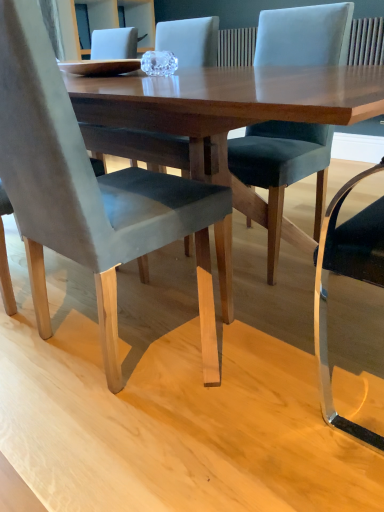
The image size is (384, 512). Describe the element at coordinates (89, 191) in the screenshot. I see `velvet grey chair at lower left, which is the 1th chair in left-to-right order` at that location.

Measure the distance between point (87,179) and camera.

A distance of 34.57 inches exists between point (87,179) and camera.

I want to click on velvet grey chair at lower left, which is the 1th chair in left-to-right order, so click(x=89, y=191).

Describe the element at coordinates (282, 169) in the screenshot. I see `velvet dark gray chair at center, the second chair viewed from the left` at that location.

Find the location of a particular element. The width and height of the screenshot is (384, 512). velvet dark gray chair at center, the 1th chair in the right-to-left sequence is located at coordinates (282, 169).

Measure the distance between point [284,153] and camera.

They are 1.50 meters apart.

You are a GUI agent. You are given a task and a screenshot of the screen. Output one action in this format:
    pyautogui.click(x=<x>, y=<y>)
    Task: Click on the velvet grey chair at lower left, which is the 1th chair in left-to-right order
    The height and width of the screenshot is (512, 384).
    Given the screenshot: What is the action you would take?
    pyautogui.click(x=89, y=191)

Which is more to the left, velvet grey chair at lower left, which is the second chair from right to left, or velvet dark gray chair at center, the 1th chair in the right-to-left sequence?

velvet grey chair at lower left, which is the second chair from right to left.

Consider the image. Relative to velvet dark gray chair at center, the 1th chair in the right-to-left sequence, is velvet grey chair at lower left, which is the 1th chair in left-to-right order, in front or behind?

In the image, velvet grey chair at lower left, which is the 1th chair in left-to-right order, appears in front of velvet dark gray chair at center, the 1th chair in the right-to-left sequence.

Which is closer, (x=118, y=376) or (x=274, y=155)?

Clearly, point (x=118, y=376) is closer to the camera than point (x=274, y=155).

From the image's perspective, which object appears higher, velvet grey chair at lower left, which is the second chair from right to left, or velvet dark gray chair at center, the 1th chair in the right-to-left sequence?

From the image's view, velvet dark gray chair at center, the 1th chair in the right-to-left sequence, is above.

From a real-world perspective, which object rests below the other?

velvet grey chair at lower left, which is the second chair from right to left.

Considering the sizes of velvet grey chair at lower left, which is the 1th chair in left-to-right order, and velvet dark gray chair at center, the 1th chair in the right-to-left sequence, in the image, is velvet grey chair at lower left, which is the 1th chair in left-to-right order, wider or thinner than velvet dark gray chair at center, the 1th chair in the right-to-left sequence,?

Considering their sizes, velvet grey chair at lower left, which is the 1th chair in left-to-right order, looks broader than velvet dark gray chair at center, the 1th chair in the right-to-left sequence.

Who is taller, velvet grey chair at lower left, which is the second chair from right to left, or velvet dark gray chair at center, the second chair viewed from the left?

velvet grey chair at lower left, which is the second chair from right to left, is taller.

From the picture: Does velvet grey chair at lower left, which is the 1th chair in left-to-right order, have a smaller size compared to velvet dark gray chair at center, the 1th chair in the right-to-left sequence?

Actually, velvet grey chair at lower left, which is the 1th chair in left-to-right order, might be larger than velvet dark gray chair at center, the 1th chair in the right-to-left sequence.

Is velvet grey chair at lower left, which is the 1th chair in left-to-right order, located outside velvet dark gray chair at center, the second chair viewed from the left?

velvet grey chair at lower left, which is the 1th chair in left-to-right order, lies outside velvet dark gray chair at center, the second chair viewed from the left,'s area.

Are velvet grey chair at lower left, which is the 1th chair in left-to-right order, and velvet dark gray chair at center, the second chair viewed from the left, far apart?

That's not correct — velvet grey chair at lower left, which is the 1th chair in left-to-right order, is a little close to velvet dark gray chair at center, the second chair viewed from the left.

Could you tell me if velvet grey chair at lower left, which is the 1th chair in left-to-right order, is facing velvet dark gray chair at center, the 1th chair in the right-to-left sequence?

Yes, velvet grey chair at lower left, which is the 1th chair in left-to-right order, is turned towards velvet dark gray chair at center, the 1th chair in the right-to-left sequence.

What's the angular difference between velvet grey chair at lower left, which is the second chair from right to left, and velvet dark gray chair at center, the second chair viewed from the left,'s facing directions?

The facing directions of velvet grey chair at lower left, which is the second chair from right to left, and velvet dark gray chair at center, the second chair viewed from the left, are 180 degrees apart.

Identify the location of chair above the velvet grey chair at lower left, which is the 1th chair in left-to-right order (from the image's perspective). The width and height of the screenshot is (384, 512). (282, 169).

Is velvet dark gray chair at center, the second chair viewed from the left, to the right of velvet grey chair at lower left, which is the second chair from right to left, from the viewer's perspective?

Correct, you'll find velvet dark gray chair at center, the second chair viewed from the left, to the right of velvet grey chair at lower left, which is the second chair from right to left.

Which object is closer to the camera taking this photo, velvet dark gray chair at center, the 1th chair in the right-to-left sequence, or velvet grey chair at lower left, which is the 1th chair in left-to-right order?

velvet grey chair at lower left, which is the 1th chair in left-to-right order.

Is point (266, 50) more distant than point (28, 175)?

That is True.

Looking at this image, from the image's perspective, which object appears higher, velvet dark gray chair at center, the 1th chair in the right-to-left sequence, or velvet grey chair at lower left, which is the second chair from right to left?

velvet dark gray chair at center, the 1th chair in the right-to-left sequence, appears higher in the image.

From a real-world perspective, is velvet dark gray chair at center, the second chair viewed from the left, on top of velvet grey chair at lower left, which is the second chair from right to left?

Yes, from a real-world perspective, velvet dark gray chair at center, the second chair viewed from the left, is on top of velvet grey chair at lower left, which is the second chair from right to left.

Considering the relative sizes of velvet dark gray chair at center, the 1th chair in the right-to-left sequence, and velvet grey chair at lower left, which is the 1th chair in left-to-right order, in the image provided, is velvet dark gray chair at center, the 1th chair in the right-to-left sequence, thinner than velvet grey chair at lower left, which is the 1th chair in left-to-right order,?

Yes, velvet dark gray chair at center, the 1th chair in the right-to-left sequence, is thinner than velvet grey chair at lower left, which is the 1th chair in left-to-right order.

Considering the sizes of objects velvet dark gray chair at center, the second chair viewed from the left, and velvet grey chair at lower left, which is the second chair from right to left, in the image provided, who is taller, velvet dark gray chair at center, the second chair viewed from the left, or velvet grey chair at lower left, which is the second chair from right to left,?

velvet grey chair at lower left, which is the second chair from right to left.

Who is smaller, velvet dark gray chair at center, the second chair viewed from the left, or velvet grey chair at lower left, which is the 1th chair in left-to-right order?

velvet dark gray chair at center, the second chair viewed from the left, is smaller.

Based on the photo, is velvet dark gray chair at center, the 1th chair in the right-to-left sequence, situated inside velvet grey chair at lower left, which is the second chair from right to left, or outside?

velvet dark gray chair at center, the 1th chair in the right-to-left sequence, cannot be found inside velvet grey chair at lower left, which is the second chair from right to left.

Is velvet dark gray chair at center, the second chair viewed from the left, not close to velvet grey chair at lower left, which is the second chair from right to left?

velvet dark gray chair at center, the second chair viewed from the left, is actually quite close to velvet grey chair at lower left, which is the second chair from right to left.

Is velvet dark gray chair at center, the 1th chair in the right-to-left sequence, oriented away from velvet grey chair at lower left, which is the 1th chair in left-to-right order?

velvet dark gray chair at center, the 1th chair in the right-to-left sequence, does not have its back to velvet grey chair at lower left, which is the 1th chair in left-to-right order.

How different are the orientations of velvet dark gray chair at center, the second chair viewed from the left, and velvet grey chair at lower left, which is the second chair from right to left, in degrees?

They differ by 180 degrees in their facing directions.

How distant is velvet dark gray chair at center, the second chair viewed from the left, from velvet grey chair at lower left, which is the 1th chair in left-to-right order?

The distance of velvet dark gray chair at center, the second chair viewed from the left, from velvet grey chair at lower left, which is the 1th chair in left-to-right order, is 23.65 inches.

Locate an element on the screen. chair located underneath the velvet dark gray chair at center, the 1th chair in the right-to-left sequence (from a real-world perspective) is located at coordinates (89, 191).

You are a GUI agent. You are given a task and a screenshot of the screen. Output one action in this format:
    pyautogui.click(x=<x>, y=<y>)
    Task: Click on the chair to the left of velvet dark gray chair at center, the 1th chair in the right-to-left sequence
    This screenshot has width=384, height=512.
    Given the screenshot: What is the action you would take?
    pyautogui.click(x=89, y=191)

Image resolution: width=384 pixels, height=512 pixels. Find the location of `chair below the velvet dark gray chair at center, the second chair viewed from the left (from the image's perspective)`. chair below the velvet dark gray chair at center, the second chair viewed from the left (from the image's perspective) is located at coordinates (89, 191).